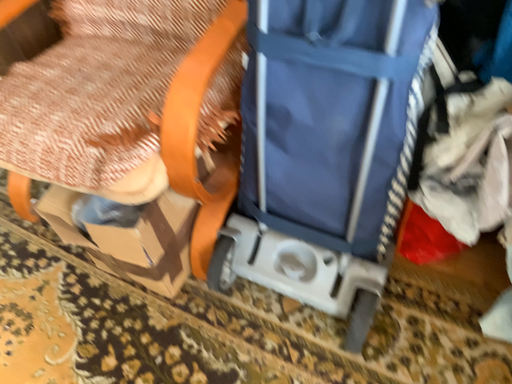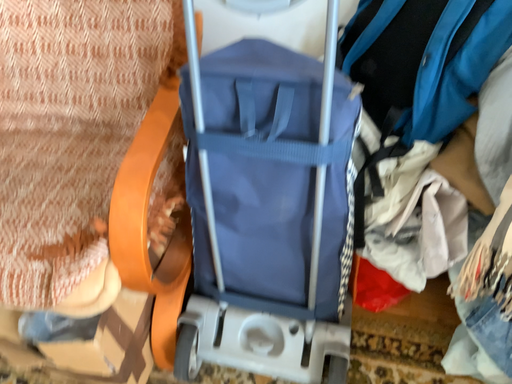
Question: Which way did the camera rotate in the video?

Choices:
 (A) rotated left
 (B) rotated right

Answer: (B)